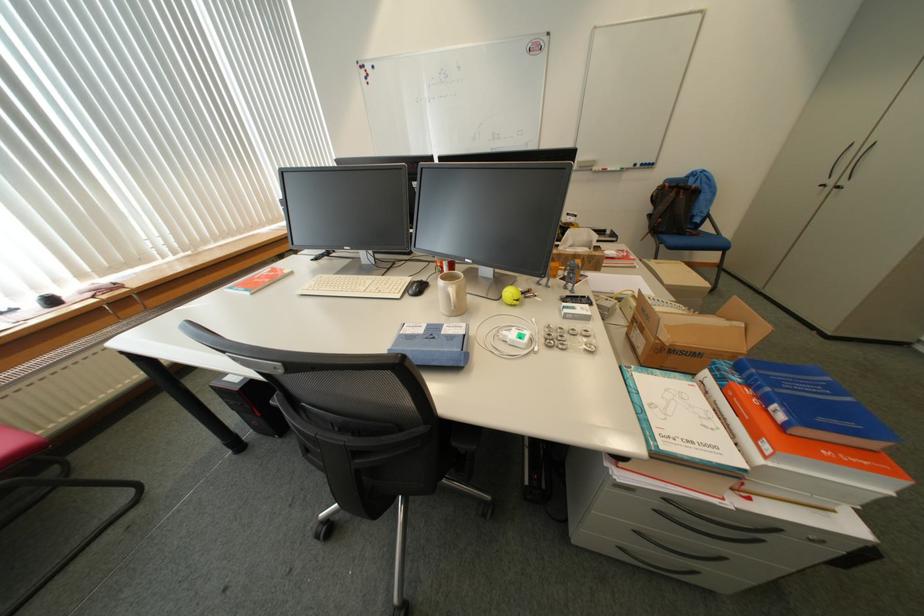
Locate an element on the screen. cabinet handle is located at coordinates (859, 160).